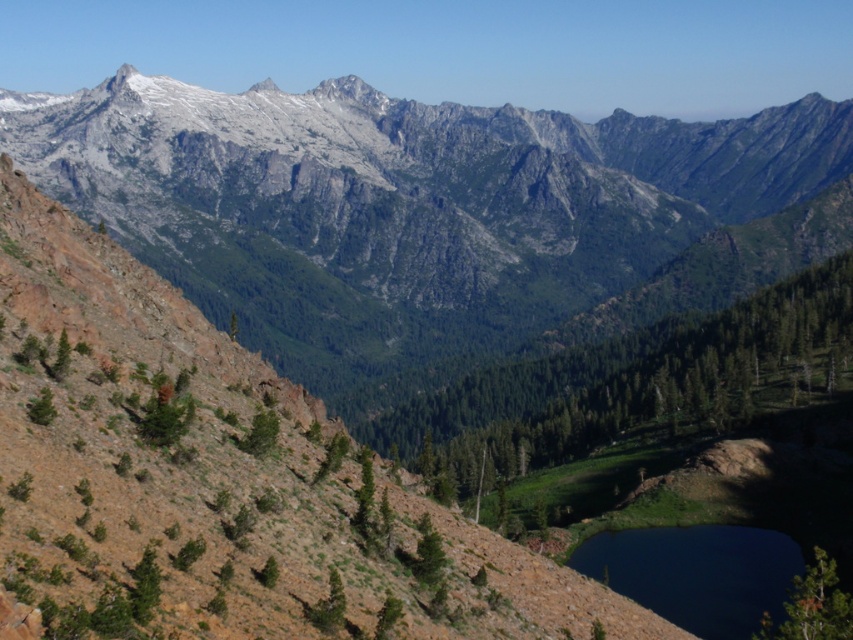
Question: Which point is closer to the camera?

Choices:
 (A) deep blue water at lower center
 (B) gray rocky mountain range at upper center

Answer: (A)

Question: Is gray rocky mountain range at upper center in front of deep blue water at lower center?

Choices:
 (A) no
 (B) yes

Answer: (A)

Question: Which object is closer to the camera taking this photo?

Choices:
 (A) deep blue water at lower center
 (B) gray rocky mountain range at upper center

Answer: (A)

Question: Observing the image, what is the correct spatial positioning of gray rocky mountain range at upper center in reference to deep blue water at lower center?

Choices:
 (A) above
 (B) below

Answer: (A)

Question: Does gray rocky mountain range at upper center have a smaller size compared to deep blue water at lower center?

Choices:
 (A) yes
 (B) no

Answer: (B)